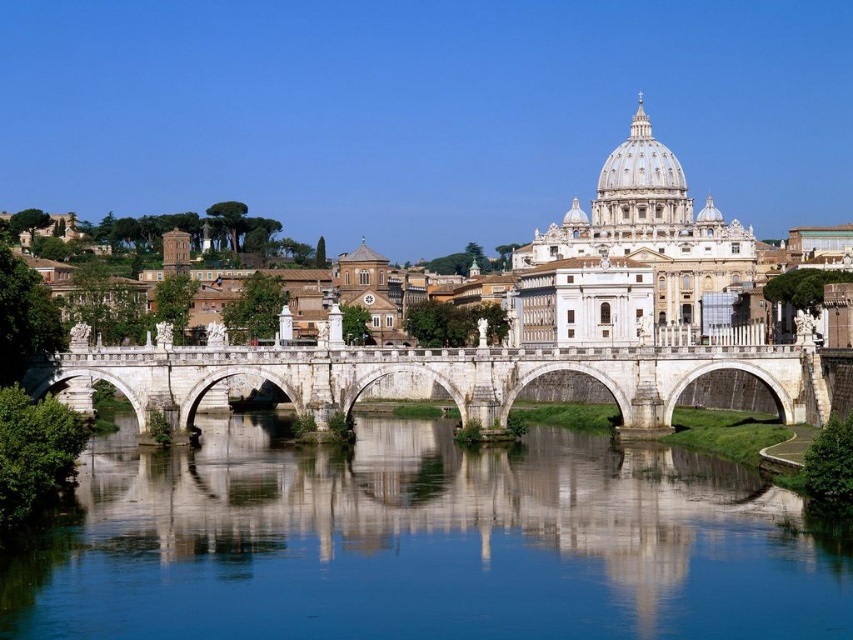
You are an architect analyzing the symmetry of the scene. Given the clear blue water at center and the white stone bridge at center, which object occupies a larger area in the image?

The white stone bridge at center occupies a larger area in the image than the clear blue water at center, as the clear blue water at center is smaller than the white stone bridge at center.

You are a tourist standing on the white stone bridge at center and want to take a photo of the clear blue water at center. Which direction should you face to capture the water in your shot?

The clear blue water at center is positioned on the right side of the white stone bridge at center. To capture the clear blue water at center, you should face to the right side of the white stone bridge at center.

From the picture: You are a tourist visiting St. Peter Basilica and want to take a photo with the clear blue water at center and white stone bridge at center in the background. If your camera can only focus on objects within 20 meters, will both objects be in focus?

The distance between the clear blue water at center and the white stone bridge at center is 19.31 meters, which is within the camera focus range of 20 meters. Therefore, both objects will be in focus.